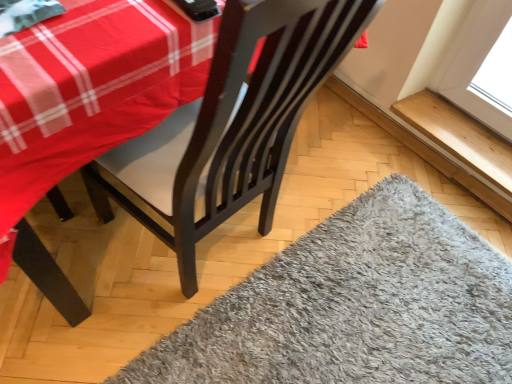
Identify the location of wooden at upper right. (459, 136).

Measure the distance between wooden at upper right and camera.

wooden at upper right is 4.70 feet away from camera.

The width and height of the screenshot is (512, 384). What do you see at coordinates (459, 136) in the screenshot?
I see `wooden at upper right` at bounding box center [459, 136].

The image size is (512, 384). Describe the element at coordinates (354, 306) in the screenshot. I see `gray shaggy rug at lower right` at that location.

You are a GUI agent. You are given a task and a screenshot of the screen. Output one action in this format:
    pyautogui.click(x=<x>, y=<y>)
    Task: Click on the gray shaggy rug at lower right
    This screenshot has height=384, width=512.
    Given the screenshot: What is the action you would take?
    pyautogui.click(x=354, y=306)

Locate an element on the screen. wooden at upper right is located at coordinates (459, 136).

Visually, is gray shaggy rug at lower right positioned to the left or to the right of wooden at upper right?

From the image, it's evident that gray shaggy rug at lower right is to the left of wooden at upper right.

Is gray shaggy rug at lower right in front of wooden at upper right?

That is True.

Considering the positions of point (377, 379) and point (460, 140), is point (377, 379) closer or farther from the camera than point (460, 140)?

Point (377, 379).

From the picture: From the image's perspective, is gray shaggy rug at lower right above or below wooden at upper right?

Clearly, from the image's perspective, gray shaggy rug at lower right is below wooden at upper right.

From a real-world perspective, is gray shaggy rug at lower right positioned over wooden at upper right based on gravity?

No, from a real-world perspective, gray shaggy rug at lower right is not above wooden at upper right.

Does gray shaggy rug at lower right have a greater width compared to wooden at upper right?

Indeed, gray shaggy rug at lower right has a greater width compared to wooden at upper right.

Considering the sizes of gray shaggy rug at lower right and wooden at upper right in the image, is gray shaggy rug at lower right taller or shorter than wooden at upper right?

In the image, gray shaggy rug at lower right appears to be taller than wooden at upper right.

Who is bigger, gray shaggy rug at lower right or wooden at upper right?

gray shaggy rug at lower right.

Which is correct: gray shaggy rug at lower right is inside wooden at upper right, or outside of it?

gray shaggy rug at lower right is not inside wooden at upper right, it's outside.

Would you consider gray shaggy rug at lower right to be distant from wooden at upper right?

No.

Is wooden at upper right at the back of gray shaggy rug at lower right?

No, gray shaggy rug at lower right is not facing away from wooden at upper right.

Where is `window sill on the right of gray shaggy rug at lower right`? The height and width of the screenshot is (384, 512). window sill on the right of gray shaggy rug at lower right is located at coordinates (459, 136).

Does wooden at upper right appear on the right side of gray shaggy rug at lower right?

Yes.

Consider the image. Is wooden at upper right positioned in front of gray shaggy rug at lower right?

No, wooden at upper right is further to the viewer.

Which point is more distant from viewer, (485, 176) or (458, 258)?

Point (485, 176)

From the image's perspective, between wooden at upper right and gray shaggy rug at lower right, which one is located above?

From the image's view, wooden at upper right is above.

From a real-world perspective, which object rests below the other?

In real-world perspective, gray shaggy rug at lower right is lower.

Which object is thinner, wooden at upper right or gray shaggy rug at lower right?

wooden at upper right is thinner.

Is wooden at upper right shorter than gray shaggy rug at lower right?

Yes.

Considering the sizes of objects wooden at upper right and gray shaggy rug at lower right in the image provided, who is smaller, wooden at upper right or gray shaggy rug at lower right?

wooden at upper right.

Is wooden at upper right inside or outside of gray shaggy rug at lower right?

wooden at upper right cannot be found inside gray shaggy rug at lower right.

Is wooden at upper right next to gray shaggy rug at lower right and touching it?

No, wooden at upper right is not in contact with gray shaggy rug at lower right.

Does wooden at upper right turn towards gray shaggy rug at lower right?

No, wooden at upper right is not turned towards gray shaggy rug at lower right.

The height and width of the screenshot is (384, 512). In order to click on window sill behind the gray shaggy rug at lower right in this screenshot , I will do `click(459, 136)`.

Locate an element on the screen. The image size is (512, 384). window sill on the right of gray shaggy rug at lower right is located at coordinates (459, 136).

The height and width of the screenshot is (384, 512). What are the coordinates of `mat located in front of the wooden at upper right` in the screenshot? It's located at (354, 306).